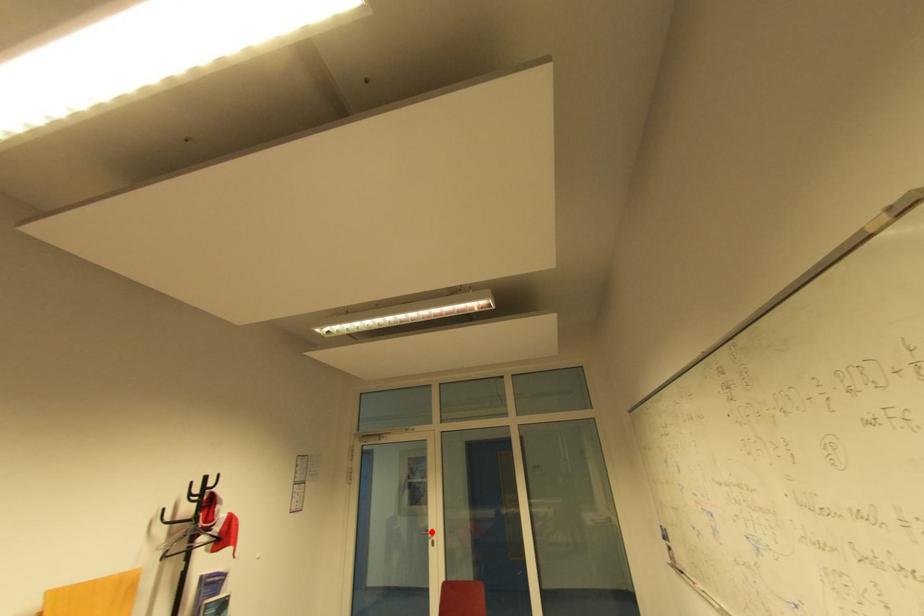
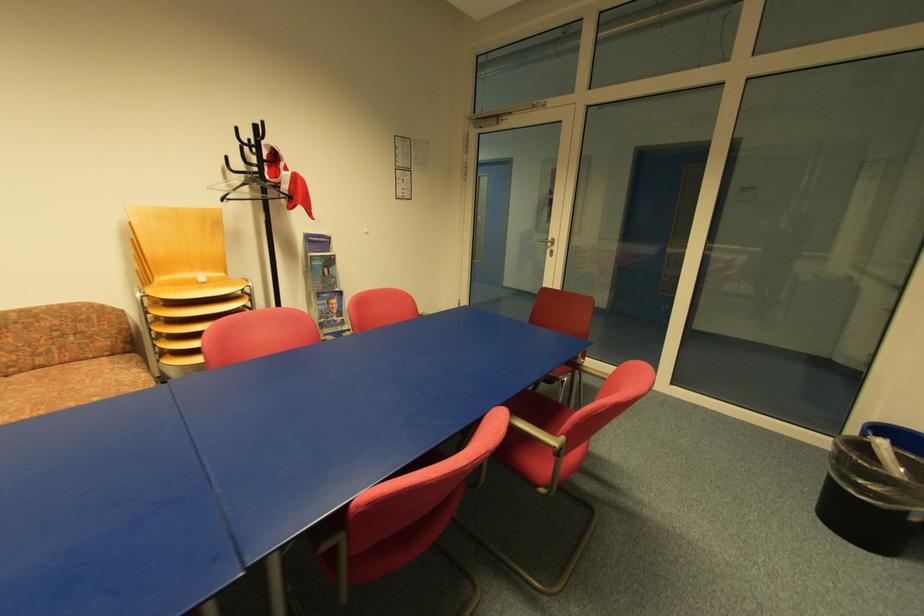
Question: I am providing you with two images of the same scene from different viewpoints. In image1, a red point is highlighted. Considering the same 3D point in image2, which of the following is correct?

Choices:
 (A) It is closer
 (B) It is farther

Answer: (A)